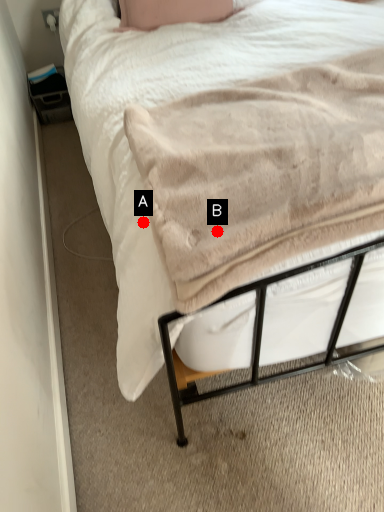
Question: Two points are circled on the image, labeled by A and B beside each circle. Which point is closer to the camera?

Choices:
 (A) A is closer
 (B) B is closer

Answer: (B)